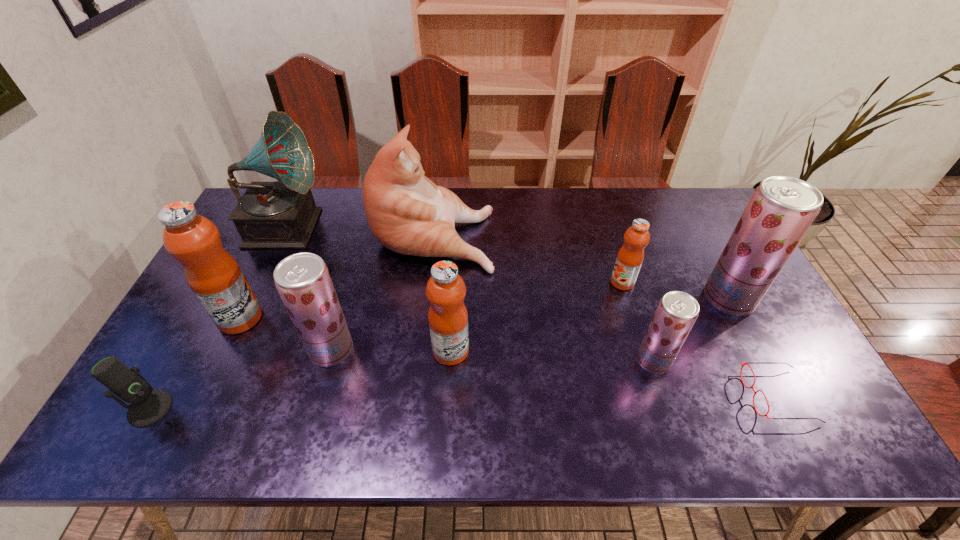
This screenshot has height=540, width=960. I want to click on blank space located on the back of the leftmost strawberry fruit juice, so click(341, 315).

What are the coordinates of `vacant region located on the front label of the third fruit juice from left to right` in the screenshot? It's located at (580, 351).

At what (x,y) coordinates should I click in order to perform the action: click on blank area located 0.310m on the back of the smallest strawberry fruit juice. Please return your answer as a coordinate pair (x, y). Image resolution: width=960 pixels, height=540 pixels. Looking at the image, I should click on (622, 265).

The image size is (960, 540). I want to click on free space located on the front label of the smallest orange fruit juice, so click(574, 282).

Where is `vacant space positioned on the front label of the smallest orange fruit juice`? The image size is (960, 540). vacant space positioned on the front label of the smallest orange fruit juice is located at coordinates tap(530, 282).

Identify the location of free region located on the front label of the smallest orange fruit juice. (534, 282).

The width and height of the screenshot is (960, 540). I want to click on vacant space situated on the back of the ninth tallest object, so click(219, 285).

Where is `free location located 0.370m on the front-facing side of the shortest object`? free location located 0.370m on the front-facing side of the shortest object is located at coordinates pos(594,396).

You are a GUI agent. You are given a task and a screenshot of the screen. Output one action in this format:
    pyautogui.click(x=<x>, y=<y>)
    Task: Click on the free spot located on the front-facing side of the shortest object
    The height and width of the screenshot is (540, 960).
    Given the screenshot: What is the action you would take?
    pyautogui.click(x=619, y=396)

Locate an element on the screen. Image resolution: width=960 pixels, height=540 pixels. blank space located 0.120m on the front-facing side of the shortest object is located at coordinates (698, 396).